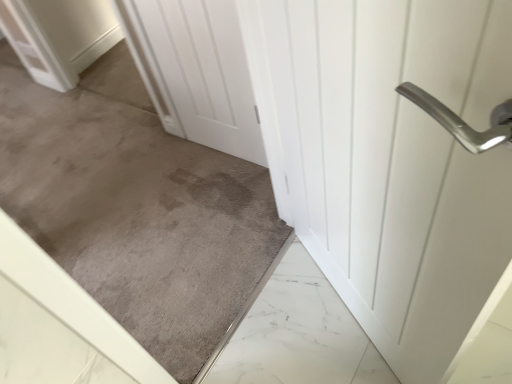
Question: Does white matte door at center, arranged as the 1th door when viewed from the left, have a larger size compared to white glossy door handle at upper right, the second door when ordered from left to right?

Choices:
 (A) no
 (B) yes

Answer: (A)

Question: Is white matte door at center, the 2th door positioned from the right, wider than white glossy door handle at upper right, the first door when ordered from right to left?

Choices:
 (A) yes
 (B) no

Answer: (B)

Question: Is white matte door at center, arranged as the 1th door when viewed from the left, at the left side of white glossy door handle at upper right, the second door when ordered from left to right?

Choices:
 (A) no
 (B) yes

Answer: (B)

Question: Is white matte door at center, arranged as the 1th door when viewed from the left, turned away from white glossy door handle at upper right, the first door when ordered from right to left?

Choices:
 (A) yes
 (B) no

Answer: (B)

Question: Is white matte door at center, the 2th door positioned from the right, not within white glossy door handle at upper right, the first door when ordered from right to left?

Choices:
 (A) no
 (B) yes

Answer: (B)

Question: Considering the relative positions of white glossy door handle at upper right, the second door when ordered from left to right, and gray carpet at center in the image provided, is white glossy door handle at upper right, the second door when ordered from left to right, to the left or to the right of gray carpet at center?

Choices:
 (A) left
 (B) right

Answer: (B)

Question: Is white glossy door handle at upper right, the second door when ordered from left to right, inside or outside of gray carpet at center?

Choices:
 (A) inside
 (B) outside

Answer: (B)

Question: Does point (486, 160) appear closer or farther from the camera than point (246, 162)?

Choices:
 (A) farther
 (B) closer

Answer: (B)

Question: From a real-world perspective, is white glossy door handle at upper right, the first door when ordered from right to left, above or below gray carpet at center?

Choices:
 (A) below
 (B) above

Answer: (A)

Question: Is gray carpet at center wider or thinner than white matte door at center, the 2th door positioned from the right?

Choices:
 (A) thin
 (B) wide

Answer: (B)

Question: In terms of height, does gray carpet at center look taller or shorter compared to white matte door at center, arranged as the 1th door when viewed from the left?

Choices:
 (A) short
 (B) tall

Answer: (B)

Question: Is gray carpet at center inside or outside of white matte door at center, the 2th door positioned from the right?

Choices:
 (A) inside
 (B) outside

Answer: (B)

Question: Based on their sizes in the image, would you say gray carpet at center is bigger or smaller than white matte door at center, the 2th door positioned from the right?

Choices:
 (A) big
 (B) small

Answer: (A)

Question: From a real-world perspective, is white matte door at center, arranged as the 1th door when viewed from the left, positioned above or below gray carpet at center?

Choices:
 (A) above
 (B) below

Answer: (B)

Question: Looking at the image, does white matte door at center, arranged as the 1th door when viewed from the left, seem bigger or smaller compared to gray carpet at center?

Choices:
 (A) big
 (B) small

Answer: (B)